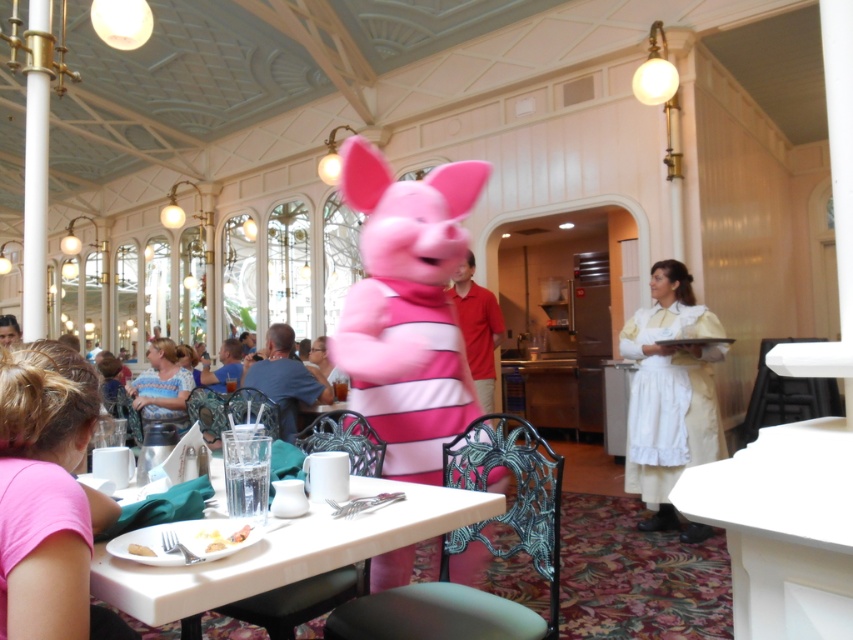
You are a guest at the themed restaurant and want to place your napkin on the white matte plate at lower left. However, you notice the blue striped shirt at lower left is blocking your view. Which object is closer to you, making it harder to access the plate?

The blue striped shirt at lower left is closer to you than the white matte plate at lower left, so it is blocking your access to the plate.

You are a photographer planning to take a group photo of the people in the scene. You need to arrange them so that the white cotton dress at right and the blue striped shirt at lower left are both visible. Which clothing item should be placed closer to the camera to ensure both are visible without one blocking the other?

The white cotton dress at right is thinner than the blue striped shirt at lower left. To ensure both are visible without one blocking the other, the thinner white cotton dress at right should be placed closer to the camera so it doesn